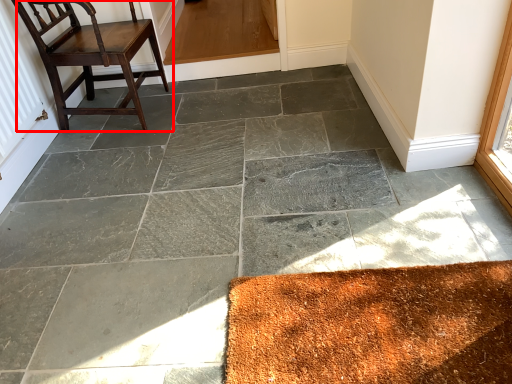
Question: Observing the image, what is the correct spatial positioning of chair (annotated by the red box) in reference to radiator?

Choices:
 (A) left
 (B) right

Answer: (B)